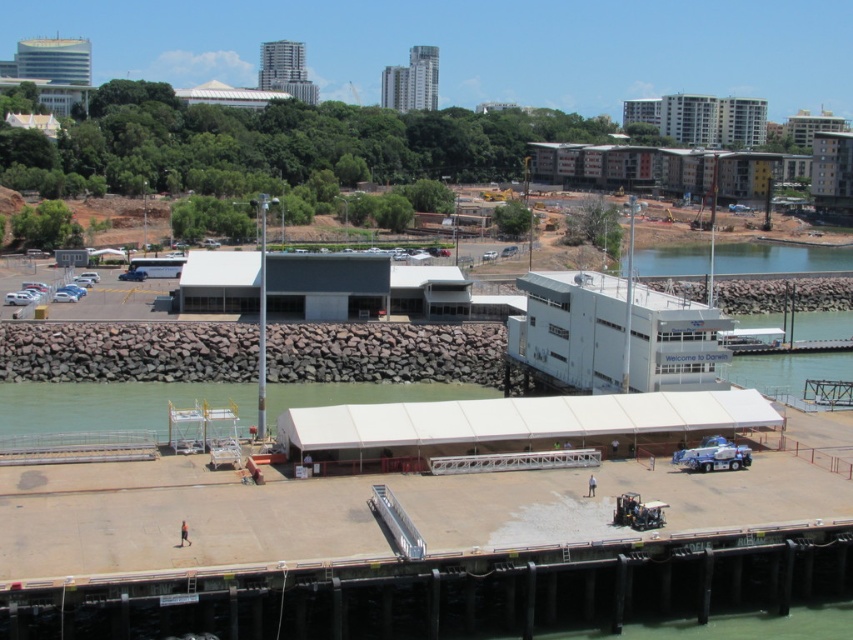
Who is positioned more to the left, clear water at lower left or clear water at lower right?

clear water at lower left is more to the left.

Is clear water at lower left positioned in front of clear water at lower right?

Yes, it is in front of clear water at lower right.

Who is more distant from viewer, (15, 413) or (682, 268)?

Positioned behind is point (682, 268).

Where is `clear water at lower left`? This screenshot has height=640, width=853. clear water at lower left is located at coordinates (111, 404).